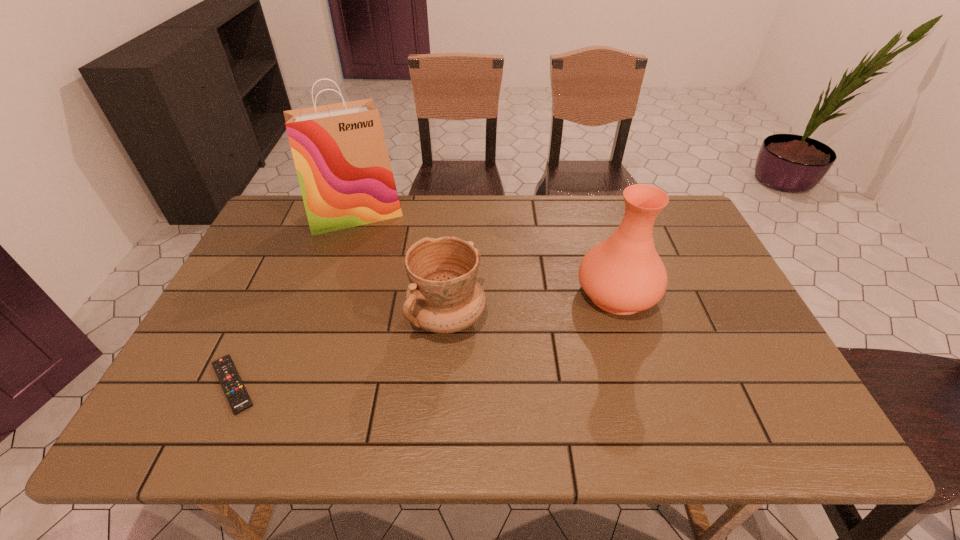
Find the location of a particular element. The height and width of the screenshot is (540, 960). vacant area at the left edge of the desktop is located at coordinates (237, 317).

In the image, there is a desktop. Identify the location of free region at the right edge. (781, 386).

I want to click on free space at the far left corner of the desktop, so click(x=307, y=239).

This screenshot has height=540, width=960. I want to click on free space at the near right corner of the desktop, so click(745, 443).

Locate an element on the screen. vacant region between the tallest object and the third tallest object is located at coordinates (401, 266).

Identify the location of vacant space that's between the vase and the second shortest object. (532, 305).

Find the location of a particular element. This screenshot has width=960, height=540. unoccupied position between the remote control and the farthest object is located at coordinates (294, 300).

Find the location of a particular element. Image resolution: width=960 pixels, height=540 pixels. free space between the nearest object and the second object from right to left is located at coordinates (340, 351).

In order to click on free spot between the third shortest object and the shortest object in this screenshot , I will do `click(425, 339)`.

Find the location of a particular element. free space between the third object from left to right and the shopping bag is located at coordinates (401, 266).